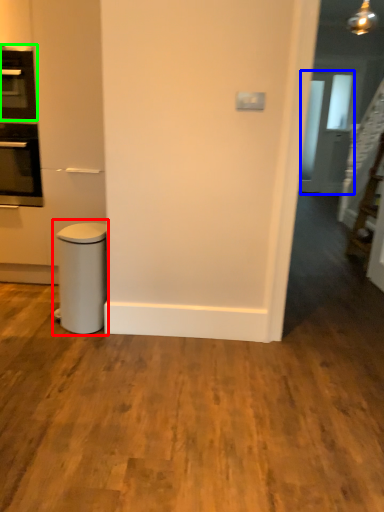
Question: Which is farther away from waste container (highlighted by a red box)? glass door (highlighted by a blue box) or home appliance (highlighted by a green box)?

Choices:
 (A) glass door
 (B) home appliance

Answer: (A)